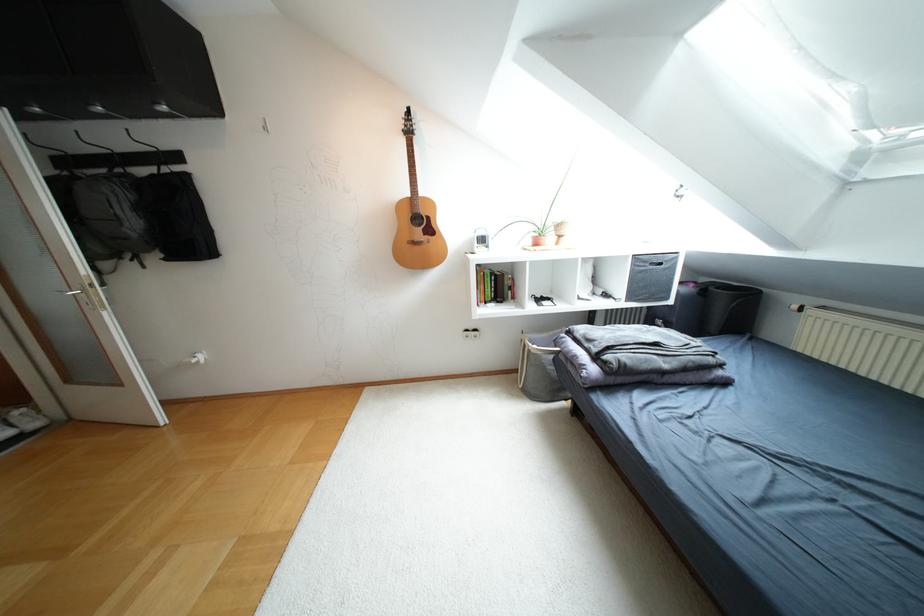
You are a GUI agent. You are given a task and a screenshot of the screen. Output one action in this format:
    pyautogui.click(x=<x>, y=<y>)
    Task: Click on the white radiator valve
    The height and width of the screenshot is (616, 924).
    Given the screenshot: What is the action you would take?
    pyautogui.click(x=834, y=321)